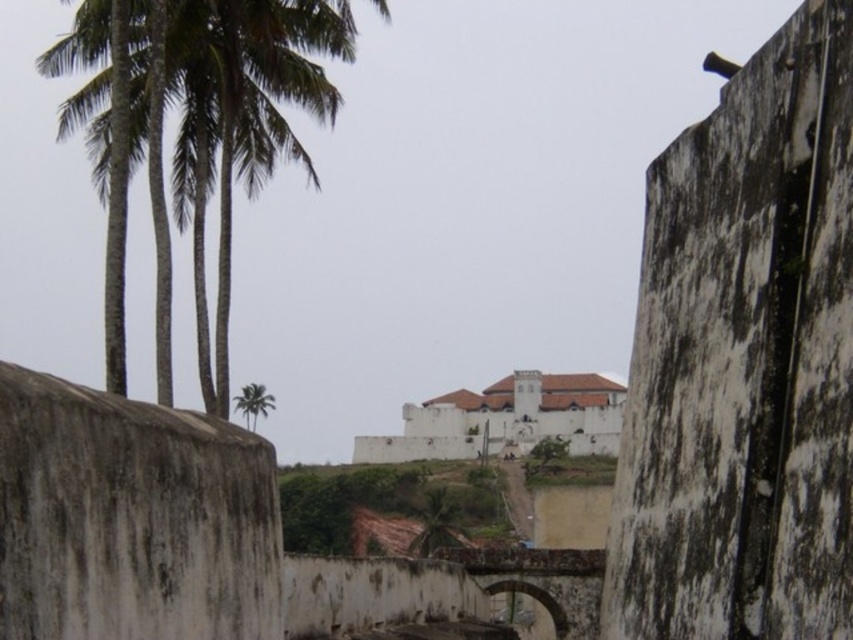
Can you confirm if white matte building at center is shorter than green leafy palm tree at upper left?

In fact, white matte building at center may be taller than green leafy palm tree at upper left.

Is point (575, 422) behind point (247, 392)?

Yes, it is behind point (247, 392).

Is point (540, 403) farther from camera compared to point (252, 397)?

Yes, it is.

Find the location of a particular element. white matte building at center is located at coordinates (505, 419).

Is point (352, 49) farther from viewer compared to point (244, 394)?

No, (352, 49) is closer to viewer.

Is green leafy palm trees at left to the left of green leafy palm tree at upper left from the viewer's perspective?

No, green leafy palm trees at left is not to the left of green leafy palm tree at upper left.

Find the location of a particular element. The height and width of the screenshot is (640, 853). green leafy palm trees at left is located at coordinates (206, 140).

Who is shorter, green leafy palm trees at left or white matte building at center?

Standing shorter between the two is white matte building at center.

Does point (112, 248) come in front of point (543, 408)?

Yes, it is.

The width and height of the screenshot is (853, 640). I want to click on green leafy palm trees at left, so click(206, 140).